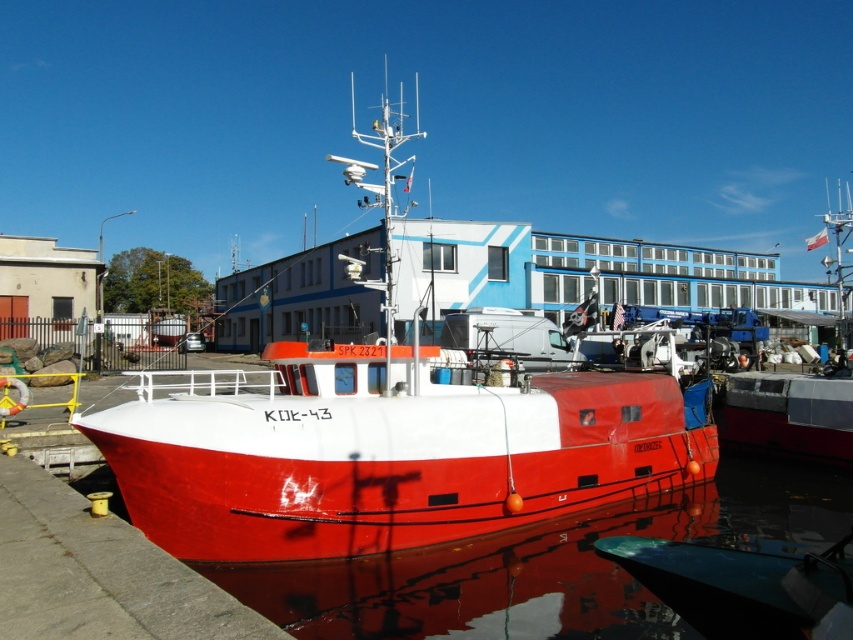
You are standing on the dock and looking at the two points marked on the image. Which point, point (675, 404) or point (793, 317), is closer to you?

Point (675, 404) is closer to you than point (793, 317).

You are standing on the dock and want to board the shiny red boat at center. Which direction should you walk to reach it from the glossy water at boat front?

The shiny red boat at center is located above the glossy water at boat front, so you should walk towards the shiny red boat at center from the glossy water at boat front.

Based on the photo, you are standing on the dock and looking at the two points marked on the image. Which point, point (850, 492) or point (776, 396), is closer to you?

Point (850, 492) is closer to the viewer than point (776, 396).